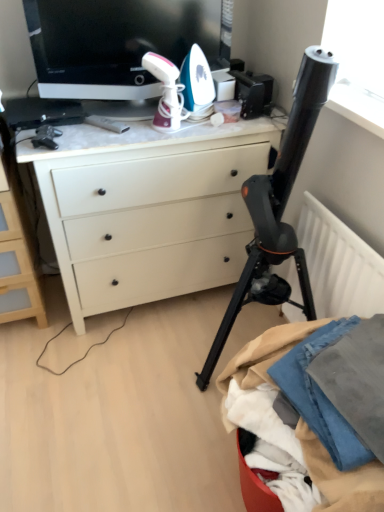
At what (x,y) coordinates should I click in order to perform the action: click on free space that is to the left of black matte tripod at center. Please return your answer as a coordinate pair (x, y). Looking at the image, I should click on (132, 380).